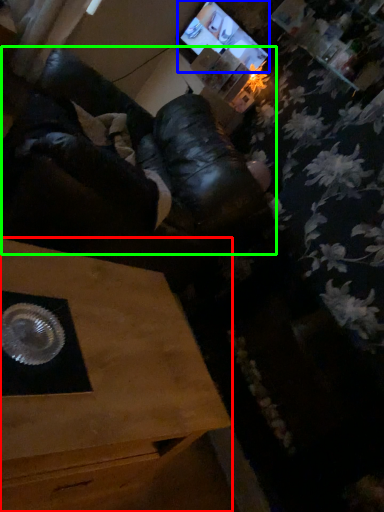
Question: Which object is positioned closest to table (highlighted by a red box)? Select from computer monitor (highlighted by a blue box) and squat (highlighted by a green box).

Choices:
 (A) computer monitor
 (B) squat

Answer: (B)